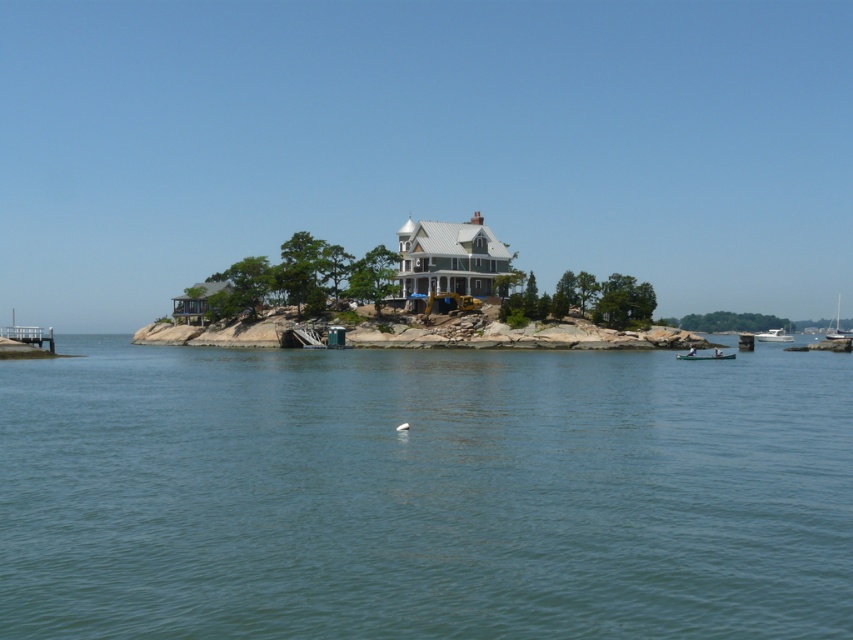
Does point (712, 349) come closer to viewer compared to point (763, 332)?

Yes, it is.

Between wooden canoe at lower right and white glossy boat at lower right, which one is positioned higher?

Positioned higher is white glossy boat at lower right.

Image resolution: width=853 pixels, height=640 pixels. I want to click on wooden canoe at lower right, so click(x=704, y=355).

Does white sailboat at right appear on the left side of white glossy boat at lower right?

Incorrect, white sailboat at right is not on the left side of white glossy boat at lower right.

Which is above, white sailboat at right or white glossy boat at lower right?

white sailboat at right is higher up.

What do you see at coordinates (837, 326) in the screenshot? I see `white sailboat at right` at bounding box center [837, 326].

Locate an element on the screen. white sailboat at right is located at coordinates (837, 326).

From the picture: Between white glossy boat at lower right and white matte bird at center, which one is positioned higher?

Positioned higher is white glossy boat at lower right.

Does white glossy boat at lower right appear on the right side of white matte bird at center?

Indeed, white glossy boat at lower right is positioned on the right side of white matte bird at center.

The image size is (853, 640). Find the location of `white glossy boat at lower right`. white glossy boat at lower right is located at coordinates (773, 336).

I want to click on white glossy boat at lower right, so (773, 336).